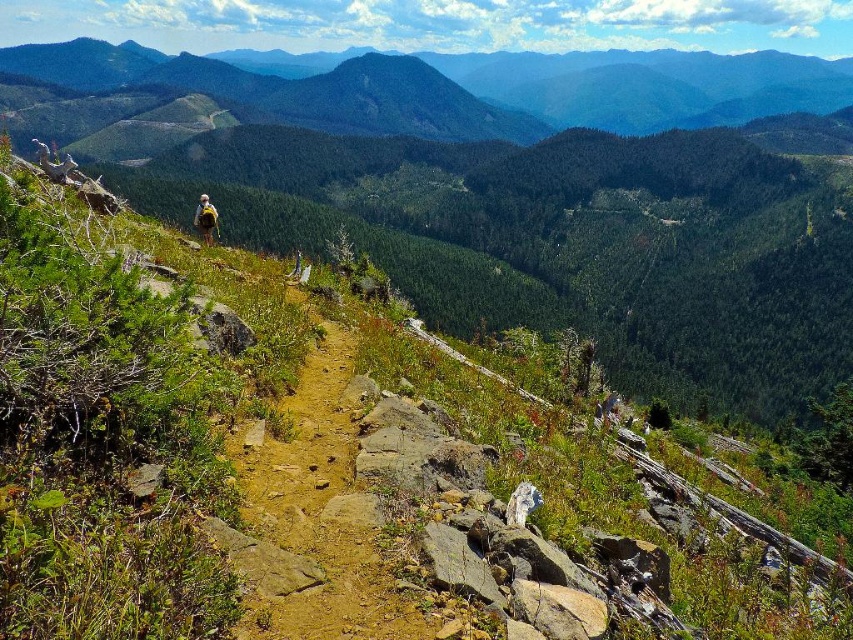
What are the coordinates of `green forested mountain at upper center` in the screenshot? It's located at (474, 86).

Does green forested mountain at upper center have a smaller size compared to dirt path at center?

Actually, green forested mountain at upper center might be larger than dirt path at center.

Which is behind, point (607, 52) or point (259, 529)?

Point (607, 52)

Where is `green forested mountain at upper center`? The width and height of the screenshot is (853, 640). green forested mountain at upper center is located at coordinates (474, 86).

Consider the image. Who is more distant from viewer, (15, 72) or (202, 198)?

Point (15, 72)

Does green forested mountain at upper center have a lesser height compared to camouflage backpack at upper left?

No.

What do you see at coordinates (474, 86) in the screenshot? This screenshot has height=640, width=853. I see `green forested mountain at upper center` at bounding box center [474, 86].

Where is `green forested mountain at upper center`? The width and height of the screenshot is (853, 640). green forested mountain at upper center is located at coordinates (474, 86).

The width and height of the screenshot is (853, 640). What do you see at coordinates (315, 516) in the screenshot? I see `dirt path at center` at bounding box center [315, 516].

Measure the distance between dirt path at center and camera.

The distance of dirt path at center from camera is 8.27 meters.

What are the coordinates of `dirt path at center` in the screenshot? It's located at (315, 516).